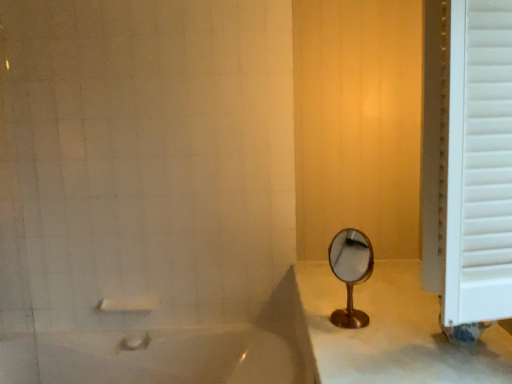
The height and width of the screenshot is (384, 512). Describe the element at coordinates (129, 304) in the screenshot. I see `white matte towel bar at lower left` at that location.

The width and height of the screenshot is (512, 384). Describe the element at coordinates (479, 164) in the screenshot. I see `white wooden window frame at right` at that location.

In order to click on white matte towel bar at lower left in this screenshot , I will do `click(129, 304)`.

Considering the sizes of objects white glossy bathtub at lower left and white wooden window frame at right in the image provided, who is thinner, white glossy bathtub at lower left or white wooden window frame at right?

white wooden window frame at right.

You are a GUI agent. You are given a task and a screenshot of the screen. Output one action in this format:
    pyautogui.click(x=<x>, y=<y>)
    Task: Click on the window frame to the right of white glossy bathtub at lower left
    
    Given the screenshot: What is the action you would take?
    pyautogui.click(x=479, y=164)

Is white glossy bathtub at lower left not within white wooden window frame at right?

Absolutely, white glossy bathtub at lower left is external to white wooden window frame at right.

Is point (349, 229) positioned in front of point (493, 305)?

No, (349, 229) is behind (493, 305).

Between gold metallic mirror at center and white wooden window frame at right, which one has smaller size?

gold metallic mirror at center is smaller.

Is gold metallic mirror at center directly adjacent to white wooden window frame at right?

gold metallic mirror at center is not next to white wooden window frame at right, and they're not touching.

From the image's perspective, is gold metallic mirror at center positioned above or below white wooden window frame at right?

gold metallic mirror at center is below white wooden window frame at right.

Measure the distance between gold metallic mirror at center and white matte towel bar at lower left.

gold metallic mirror at center is 38.48 inches from white matte towel bar at lower left.

Between gold metallic mirror at center and white matte towel bar at lower left, which one appears on the left side from the viewer's perspective?

Positioned to the left is white matte towel bar at lower left.

Would you say gold metallic mirror at center is inside or outside white matte towel bar at lower left?

gold metallic mirror at center is spatially situated outside white matte towel bar at lower left.

Considering the relative positions of white wooden window frame at right and gold metallic mirror at center in the image provided, is white wooden window frame at right in front of gold metallic mirror at center?

Yes, white wooden window frame at right is closer to the viewer.

Is white wooden window frame at right wider than gold metallic mirror at center?

Yes.

Considering the sizes of objects white wooden window frame at right and gold metallic mirror at center in the image provided, who is shorter, white wooden window frame at right or gold metallic mirror at center?

gold metallic mirror at center.

There is a gold metallic mirror at center. Identify the location of window frame above it (from a real-world perspective). The height and width of the screenshot is (384, 512). (479, 164).

The image size is (512, 384). I want to click on bathtub to the left of gold metallic mirror at center, so click(x=153, y=357).

Considering the relative sizes of white glossy bathtub at lower left and gold metallic mirror at center in the image provided, is white glossy bathtub at lower left thinner than gold metallic mirror at center?

No.

Does white glossy bathtub at lower left turn towards gold metallic mirror at center?

No, white glossy bathtub at lower left is not aimed at gold metallic mirror at center.

In terms of height, does white glossy bathtub at lower left look taller or shorter compared to gold metallic mirror at center?

Considering their sizes, white glossy bathtub at lower left has more height than gold metallic mirror at center.

From the image's perspective, between white matte towel bar at lower left and white wooden window frame at right, who is located below?

white matte towel bar at lower left, from the image's perspective.

Where is `window frame above the white matte towel bar at lower left (from a real-world perspective)`? Image resolution: width=512 pixels, height=384 pixels. window frame above the white matte towel bar at lower left (from a real-world perspective) is located at coordinates (479, 164).

Considering the relative sizes of white matte towel bar at lower left and white wooden window frame at right in the image provided, is white matte towel bar at lower left taller than white wooden window frame at right?

No.

Is point (117, 304) less distant than point (500, 50)?

No, (117, 304) is behind (500, 50).

From a real-world perspective, is white wooden window frame at right above or below white matte towel bar at lower left?

white wooden window frame at right is situated higher than white matte towel bar at lower left in the real world.

Can you confirm if white wooden window frame at right is positioned to the right of white matte towel bar at lower left?

Indeed, white wooden window frame at right is positioned on the right side of white matte towel bar at lower left.

Is white wooden window frame at right thinner than white matte towel bar at lower left?

No, white wooden window frame at right is not thinner than white matte towel bar at lower left.

Image resolution: width=512 pixels, height=384 pixels. In order to click on window frame above the white glossy bathtub at lower left (from the image's perspective) in this screenshot , I will do `click(479, 164)`.

Where is `mirror below the white wooden window frame at right (from the image's perspective)`? Image resolution: width=512 pixels, height=384 pixels. mirror below the white wooden window frame at right (from the image's perspective) is located at coordinates (350, 272).

Which object lies nearer to the anchor point gold metallic mirror at center, white glossy bathtub at lower left or white matte towel bar at lower left?

The object closer to gold metallic mirror at center is white glossy bathtub at lower left.

When comparing their distances from gold metallic mirror at center, does white glossy bathtub at lower left or white wooden window frame at right seem closer?

white wooden window frame at right is positioned closer to the anchor gold metallic mirror at center.

Estimate the real-world distances between objects in this image. Which object is closer to gold metallic mirror at center, white matte towel bar at lower left or white wooden window frame at right?

Based on the image, white wooden window frame at right appears to be nearer to gold metallic mirror at center.

Considering their positions, is white wooden window frame at right positioned closer to white matte towel bar at lower left than gold metallic mirror at center?

gold metallic mirror at center.

From the image, which object appears to be nearer to white wooden window frame at right, gold metallic mirror at center or white matte towel bar at lower left?

Among the two, gold metallic mirror at center is located nearer to white wooden window frame at right.

Looking at the image, which one is located further to white matte towel bar at lower left, white wooden window frame at right or white glossy bathtub at lower left?

Based on the image, white wooden window frame at right appears to be further to white matte towel bar at lower left.

When comparing their distances from white glossy bathtub at lower left, does white matte towel bar at lower left or gold metallic mirror at center seem further?

gold metallic mirror at center.

From the picture: Based on their spatial positions, is gold metallic mirror at center or white wooden window frame at right closer to white glossy bathtub at lower left?

gold metallic mirror at center is closer to white glossy bathtub at lower left.

The height and width of the screenshot is (384, 512). In order to click on bathtub situated between white matte towel bar at lower left and gold metallic mirror at center from left to right in this screenshot , I will do `click(153, 357)`.

Identify the location of mirror situated between white glossy bathtub at lower left and white wooden window frame at right from left to right. The height and width of the screenshot is (384, 512). (350, 272).

You are a GUI agent. You are given a task and a screenshot of the screen. Output one action in this format:
    pyautogui.click(x=<x>, y=<y>)
    Task: Click on the mirror situated between white matte towel bar at lower left and white wooden window frame at right from left to right
    This screenshot has width=512, height=384.
    Given the screenshot: What is the action you would take?
    pyautogui.click(x=350, y=272)

I want to click on bathtub between white matte towel bar at lower left and white wooden window frame at right from left to right, so click(153, 357).